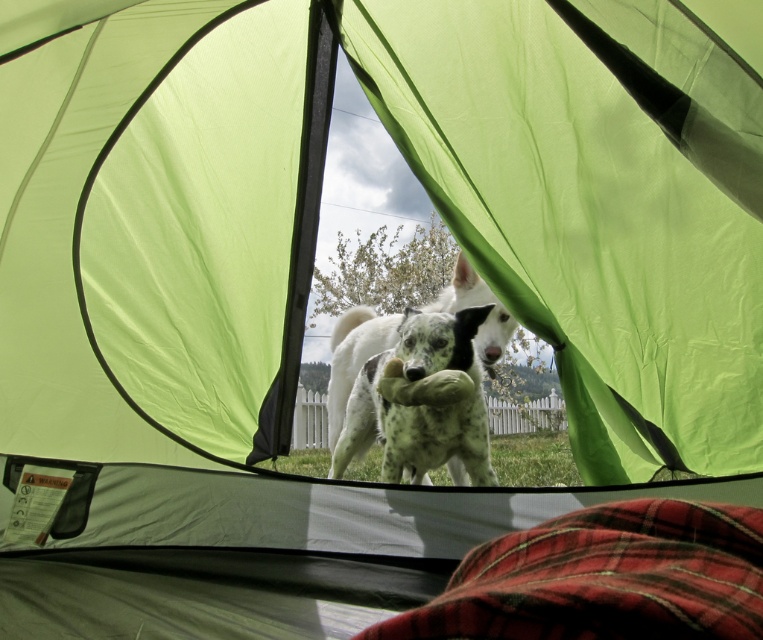
Is red plaid blanket at lower right below speckled fur dog at center?

Incorrect, red plaid blanket at lower right is not positioned below speckled fur dog at center.

In the scene shown: Does red plaid blanket at lower right appear on the left side of speckled fur dog at center?

Incorrect, red plaid blanket at lower right is not on the left side of speckled fur dog at center.

Find the location of a particular element. This screenshot has height=640, width=763. red plaid blanket at lower right is located at coordinates (604, 579).